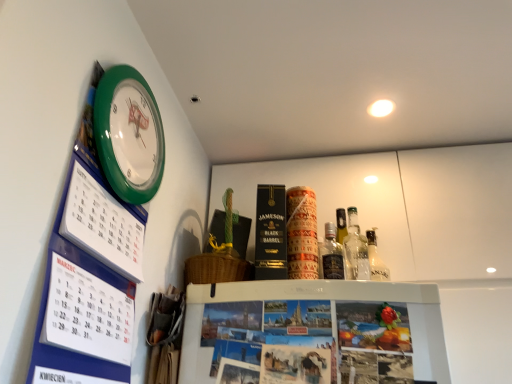
Question: Is blue cardboard calendar at upper left at the left side of green plastic wall clock at upper left?

Choices:
 (A) no
 (B) yes

Answer: (A)

Question: From the image's perspective, does blue cardboard calendar at upper left appear lower than green plastic wall clock at upper left?

Choices:
 (A) yes
 (B) no

Answer: (A)

Question: From a real-world perspective, is blue cardboard calendar at upper left below green plastic wall clock at upper left?

Choices:
 (A) yes
 (B) no

Answer: (A)

Question: Are blue cardboard calendar at upper left and green plastic wall clock at upper left making contact?

Choices:
 (A) yes
 (B) no

Answer: (B)

Question: Considering the relative sizes of blue cardboard calendar at upper left and green plastic wall clock at upper left in the image provided, is blue cardboard calendar at upper left shorter than green plastic wall clock at upper left?

Choices:
 (A) no
 (B) yes

Answer: (A)

Question: Considering their positions, is translucent glass bottle at upper right located in front of or behind blue cardboard calendar at upper left?

Choices:
 (A) behind
 (B) front

Answer: (A)

Question: From the image's perspective, relative to blue cardboard calendar at upper left, is translucent glass bottle at upper right above or below?

Choices:
 (A) above
 (B) below

Answer: (B)

Question: Is point (322, 248) closer or farther from the camera than point (88, 246)?

Choices:
 (A) closer
 (B) farther

Answer: (B)

Question: Considering the positions of translucent glass bottle at upper right and blue cardboard calendar at upper left in the image, is translucent glass bottle at upper right bigger or smaller than blue cardboard calendar at upper left?

Choices:
 (A) small
 (B) big

Answer: (A)

Question: From the image's perspective, relative to blue cardboard calendar at upper left, is green plastic wall clock at upper left above or below?

Choices:
 (A) above
 (B) below

Answer: (A)

Question: Visually, is green plastic wall clock at upper left positioned to the left or to the right of blue cardboard calendar at upper left?

Choices:
 (A) left
 (B) right

Answer: (A)

Question: Considering the positions of green plastic wall clock at upper left and blue cardboard calendar at upper left in the image, is green plastic wall clock at upper left wider or thinner than blue cardboard calendar at upper left?

Choices:
 (A) wide
 (B) thin

Answer: (B)

Question: Based on their sizes in the image, would you say green plastic wall clock at upper left is bigger or smaller than blue cardboard calendar at upper left?

Choices:
 (A) small
 (B) big

Answer: (A)

Question: Is translucent glass bottle at upper right in front of or behind green plastic wall clock at upper left in the image?

Choices:
 (A) front
 (B) behind

Answer: (B)

Question: Is translucent glass bottle at upper right situated inside green plastic wall clock at upper left or outside?

Choices:
 (A) inside
 (B) outside

Answer: (B)